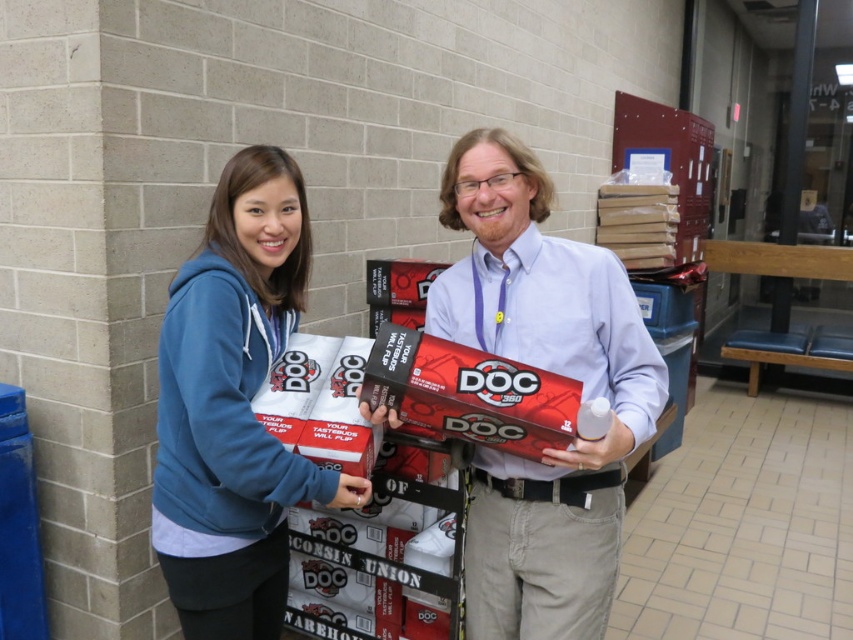
Question: Among these objects, which one is nearest to the camera?

Choices:
 (A) blue fleece hoodie at left
 (B) red matte/doc at center
 (C) matte white box at center

Answer: (C)

Question: In this image, where is blue fleece hoodie at left located relative to red matte/doc at center?

Choices:
 (A) right
 (B) left

Answer: (B)

Question: Which object is the farthest from the red matte/doc at center?

Choices:
 (A) blue fleece hoodie at left
 (B) matte white box at center

Answer: (A)

Question: Does matte white box at center have a greater width compared to red matte/doc at center?

Choices:
 (A) yes
 (B) no

Answer: (A)

Question: Which point is closer to the camera?

Choices:
 (A) red matte/doc at center
 (B) matte white box at center

Answer: (B)

Question: Considering the relative positions of blue fleece hoodie at left and red matte/doc at center in the image provided, where is blue fleece hoodie at left located with respect to red matte/doc at center?

Choices:
 (A) below
 (B) above

Answer: (A)